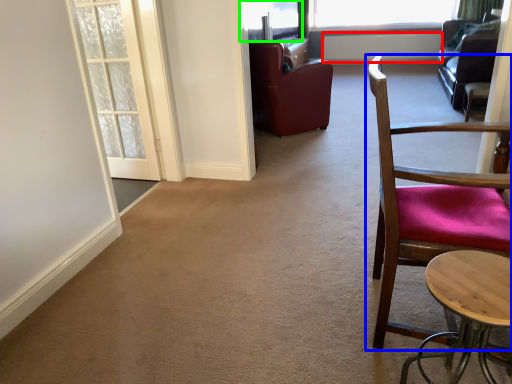
Question: Considering the real-world distances, which object is closest to radiator (highlighted by a red box)? chair (highlighted by a blue box) or window screen (highlighted by a green box).

Choices:
 (A) chair
 (B) window screen

Answer: (B)